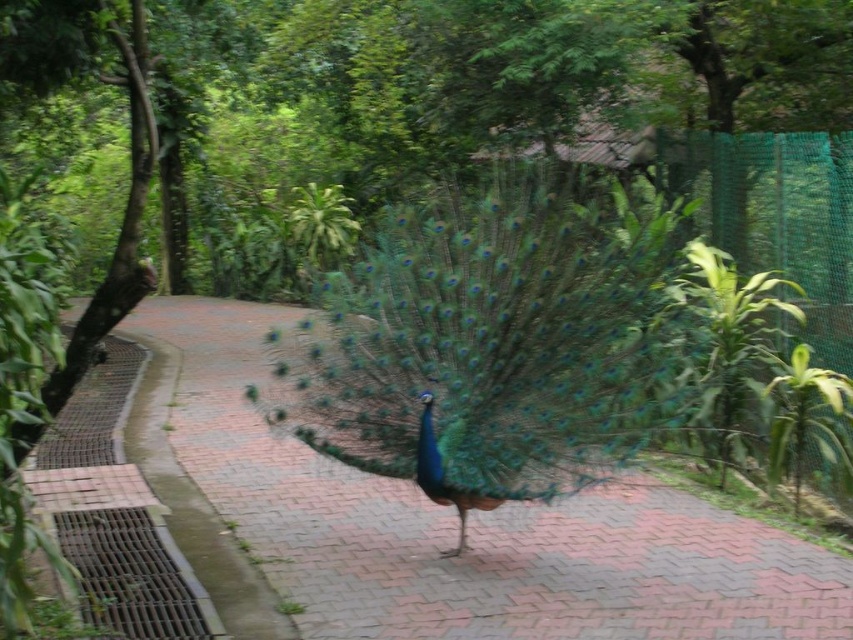
What do you see at coordinates (494, 342) in the screenshot? I see `shiny blue peacock at center` at bounding box center [494, 342].

Does shiny blue peacock at center have a lesser height compared to brick pavement at center?

Correct, shiny blue peacock at center is not as tall as brick pavement at center.

Where is `shiny blue peacock at center`? Image resolution: width=853 pixels, height=640 pixels. shiny blue peacock at center is located at coordinates (494, 342).